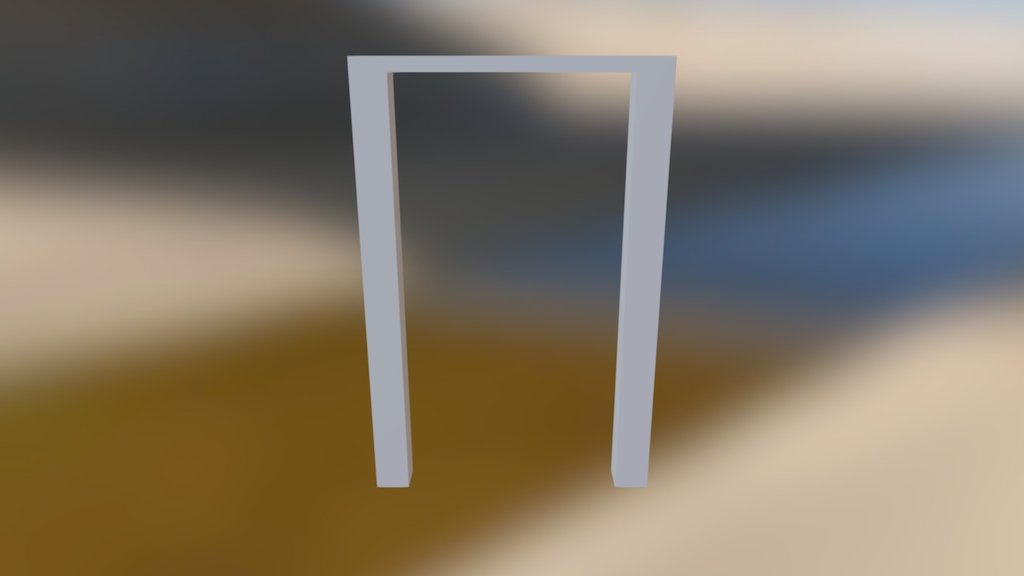
Image resolution: width=1024 pixels, height=576 pixels. In order to click on white 3d rendered image of a left table leg in this screenshot , I will do `click(389, 289)`.